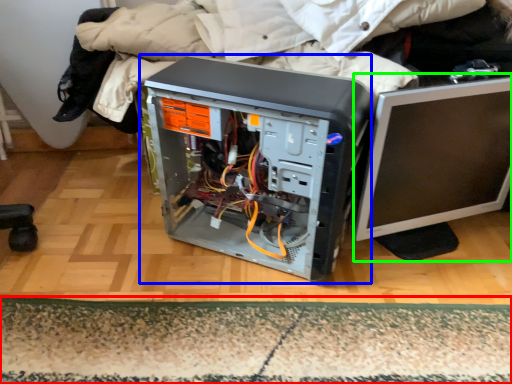
Question: Which object is the farthest from mat (highlighted by a red box)? Choose among these: computer tower (highlighted by a blue box) or computer monitor (highlighted by a green box).

Choices:
 (A) computer tower
 (B) computer monitor

Answer: (B)